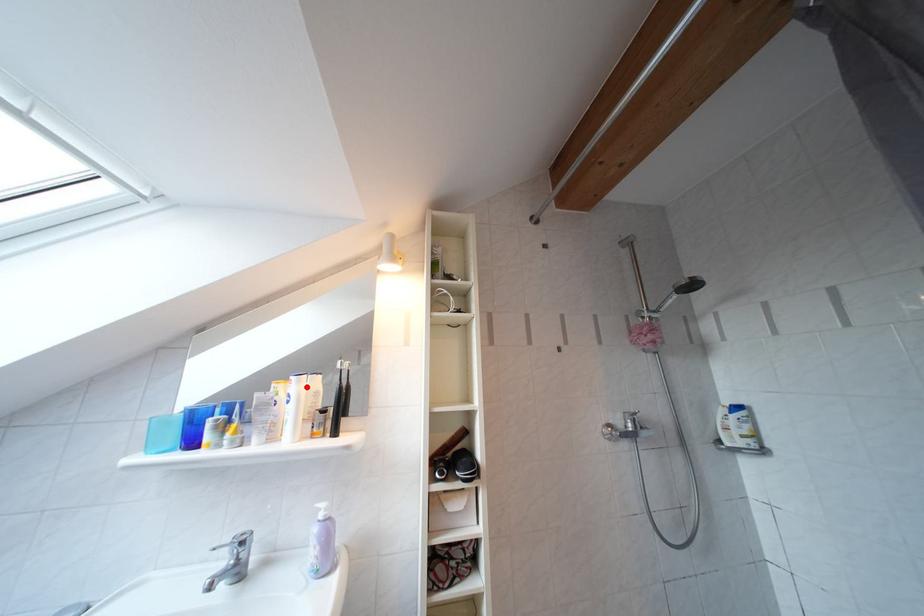
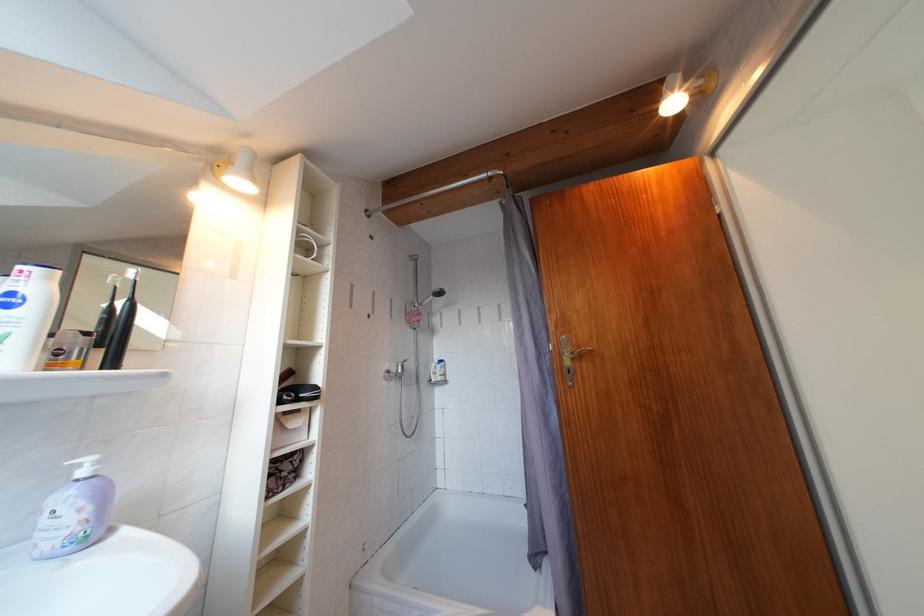
The point at the highlighted location is marked in the first image. Where is the corresponding point in the second image?

(56, 283)